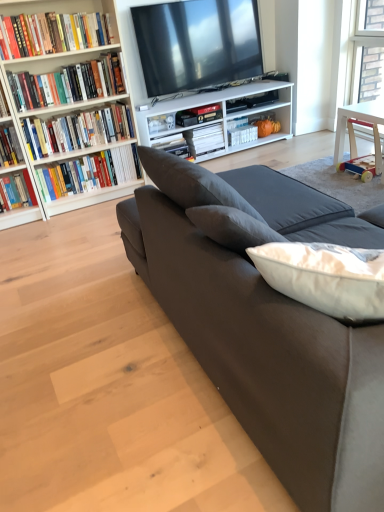
Question: Can we say hardcover book at left, the 3th book viewed from the front, lies outside white matte book at center, the 6th book viewed from the front?

Choices:
 (A) no
 (B) yes

Answer: (B)

Question: From the image's perspective, is hardcover book at left, the 3th book viewed from the front, under white matte book at center, which ranks as the 2th book in back-to-front order?

Choices:
 (A) no
 (B) yes

Answer: (B)

Question: Can you confirm if hardcover book at left, which appears as the fifth book when viewed from the back, is taller than white matte book at center, which ranks as the 2th book in back-to-front order?

Choices:
 (A) no
 (B) yes

Answer: (A)

Question: Is hardcover book at left, which appears as the fifth book when viewed from the back, bigger than white matte book at center, which ranks as the 2th book in back-to-front order?

Choices:
 (A) no
 (B) yes

Answer: (B)

Question: Is hardcover book at left, the 3th book viewed from the front, further to the viewer compared to white matte book at center, the 6th book viewed from the front?

Choices:
 (A) no
 (B) yes

Answer: (A)

Question: Can you confirm if hardcover book at left, the 3th book viewed from the front, is positioned to the right of white matte book at center, the 6th book viewed from the front?

Choices:
 (A) no
 (B) yes

Answer: (A)

Question: Is suede couch at center located outside matte black tv at upper center?

Choices:
 (A) no
 (B) yes

Answer: (B)

Question: From a real-world perspective, does suede couch at center sit lower than matte black tv at upper center?

Choices:
 (A) yes
 (B) no

Answer: (A)

Question: Does suede couch at center have a larger size compared to matte black tv at upper center?

Choices:
 (A) no
 (B) yes

Answer: (B)

Question: Is suede couch at center positioned far away from matte black tv at upper center?

Choices:
 (A) no
 (B) yes

Answer: (B)

Question: Can you confirm if suede couch at center is taller than matte black tv at upper center?

Choices:
 (A) yes
 (B) no

Answer: (A)

Question: From a real-world perspective, is suede couch at center on top of matte black tv at upper center?

Choices:
 (A) yes
 (B) no

Answer: (B)

Question: Is white matte book at center, which is the seventh book from front to back, completely or partially outside of suede couch at center?

Choices:
 (A) yes
 (B) no

Answer: (A)